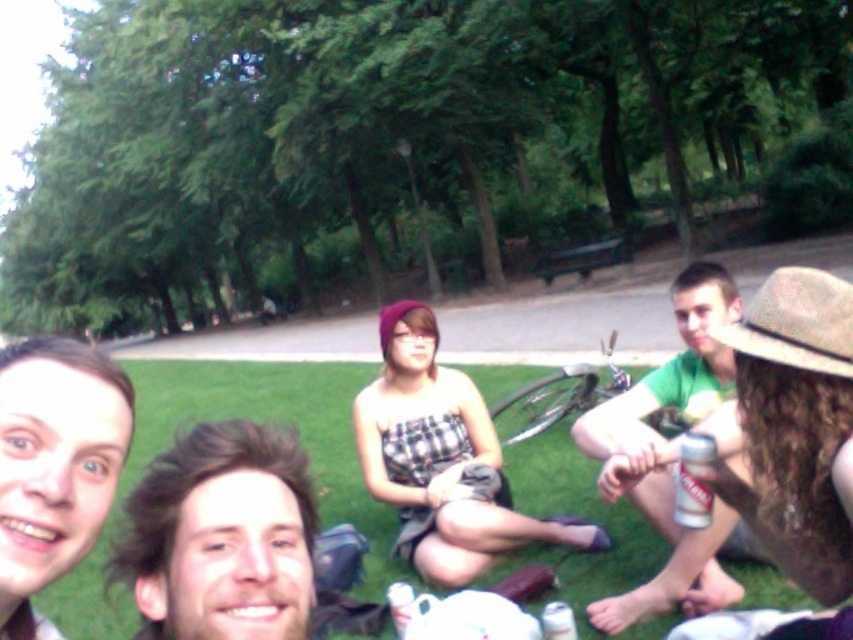
You are a photographer taking a picture of the green grass at lower center and the green matte shirt at center. Which object is positioned lower in the image?

The green grass at lower center is positioned lower than the green matte shirt at center.

You are a photographer trying to capture a closeup of the green grass at lower center while also including the green matte shirt at center in the frame. Given the distance between them, will you need to adjust your camera settings to focus on both objects simultaneously?

The green grass at lower center and green matte shirt at center are 10.56 feet apart from each other. To focus on both objects simultaneously, you would need to adjust your camera settings to increase the depth of field, ensuring both are in clear focus.